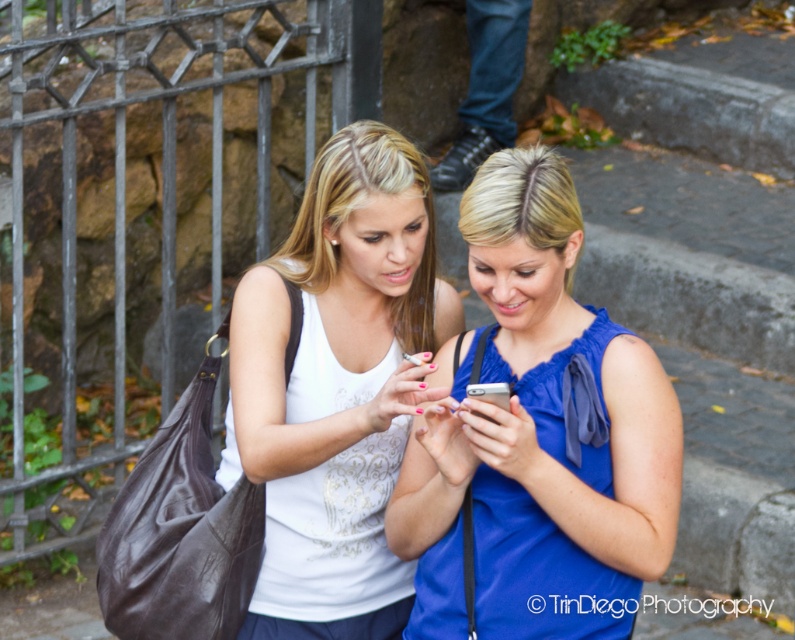
Question: Can you confirm if white satin tank top at center is bigger than silver metallic smartphone at center?

Choices:
 (A) no
 (B) yes

Answer: (B)

Question: Can you confirm if blue fabric phone at center is positioned to the right of silver metallic smartphone at center?

Choices:
 (A) no
 (B) yes

Answer: (B)

Question: Does blue satin blouse at center have a larger size compared to blue fabric phone at center?

Choices:
 (A) yes
 (B) no

Answer: (A)

Question: Which point is closer to the camera?

Choices:
 (A) (640, 444)
 (B) (405, 230)
 (C) (475, 413)
 (D) (528, 604)

Answer: (C)

Question: Among these objects, which one is nearest to the camera?

Choices:
 (A) white satin tank top at center
 (B) silver metallic smartphone at center

Answer: (B)

Question: Which of the following is the farthest from the observer?

Choices:
 (A) blue fabric phone at center
 (B) white satin tank top at center

Answer: (A)